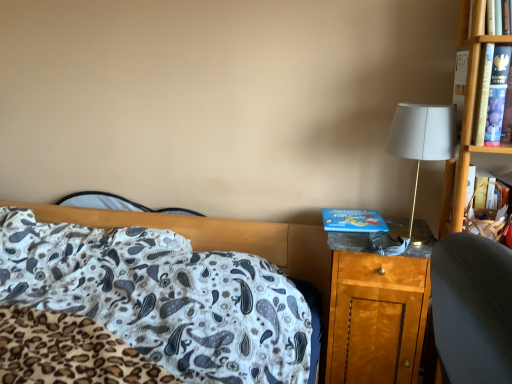
From the picture: Measure the distance between point (66, 311) and camera.

Point (66, 311) is 5.00 feet away from camera.

Describe the element at coordinates (421, 144) in the screenshot. This screenshot has height=384, width=512. I see `white fabric lampshade at right` at that location.

The image size is (512, 384). Identify the location of white paisley fabric at center. (163, 297).

Which point is more distant from viewer, (x=179, y=300) or (x=404, y=116)?

The point (x=179, y=300) is more distant.

Is white paisley fabric at center with white fabric lampshade at right?

No, white paisley fabric at center is not with white fabric lampshade at right.

Is white paisley fabric at center positioned beyond the bounds of white fabric lampshade at right?

Yes, white paisley fabric at center is located beyond the bounds of white fabric lampshade at right.

Based on the photo, looking at the image, does white paisley fabric at center seem bigger or smaller compared to white fabric lampshade at right?

Clearly, white paisley fabric at center is larger in size than white fabric lampshade at right.

Is wooden nightstand at right smaller than white paisley fabric at center?

Correct, wooden nightstand at right occupies less space than white paisley fabric at center.

Considering the points (361, 381) and (226, 257), which point is behind, point (361, 381) or point (226, 257)?

Positioned behind is point (226, 257).

Based on the photo, is the position of wooden nightstand at right more distant than that of white paisley fabric at center?

Yes, it is behind white paisley fabric at center.

Between wooden nightstand at right and white paisley fabric at center, which one has larger width?

Wider between the two is white paisley fabric at center.

Considering the sizes of objects white paisley fabric at center and wooden nightstand at right in the image provided, who is wider, white paisley fabric at center or wooden nightstand at right?

white paisley fabric at center.

Which is behind, point (210, 317) or point (428, 297)?

The point (428, 297) is behind.

Does white paisley fabric at center touch wooden nightstand at right?

white paisley fabric at center is not next to wooden nightstand at right, and they're not touching.

From the image's perspective, who appears lower, white fabric lampshade at right or wooden nightstand at right?

wooden nightstand at right.

Does white fabric lampshade at right contain wooden nightstand at right?

No, wooden nightstand at right is located outside of white fabric lampshade at right.

Which is farther from the camera, (435, 160) or (395, 368)?

The point (395, 368) is more distant.

In terms of width, does blue cardboard book at right look wider or thinner when compared to white paisley fabric at center?

blue cardboard book at right is thinner than white paisley fabric at center.

Locate an element on the screen. Image resolution: width=512 pixels, height=384 pixels. bed below the blue cardboard book at right (from the image's perspective) is located at coordinates click(x=163, y=297).

Considering the relative positions of blue cardboard book at right and white paisley fabric at center in the image provided, is blue cardboard book at right to the left of white paisley fabric at center from the viewer's perspective?

Incorrect, blue cardboard book at right is not on the left side of white paisley fabric at center.

Does wooden nightstand at right appear on the right side of white fabric lampshade at right?

In fact, wooden nightstand at right is to the left of white fabric lampshade at right.

From a real-world perspective, is wooden nightstand at right above or below white fabric lampshade at right?

From a real-world perspective, wooden nightstand at right is physically below white fabric lampshade at right.

Looking at this image, from the image's perspective, is wooden nightstand at right over white fabric lampshade at right?

No, from the image's perspective, wooden nightstand at right is not on top of white fabric lampshade at right.

Considering the sizes of objects wooden nightstand at right and white fabric lampshade at right in the image provided, who is taller, wooden nightstand at right or white fabric lampshade at right?

Standing taller between the two is wooden nightstand at right.

Is wooden nightstand at right wider than blue cardboard book at right?

Correct, the width of wooden nightstand at right exceeds that of blue cardboard book at right.

Measure the distance between wooden nightstand at right and blue cardboard book at right.

11.95 inches.

From a real-world perspective, who is located lower, wooden nightstand at right or blue cardboard book at right?

wooden nightstand at right.

Where is `bed below the white fabric lampshade at right (from the image's perspective)`? This screenshot has width=512, height=384. bed below the white fabric lampshade at right (from the image's perspective) is located at coordinates (163, 297).

Locate an element on the screen. Image resolution: width=512 pixels, height=384 pixels. bed lying above the wooden nightstand at right (from the image's perspective) is located at coordinates (163, 297).

From the picture: Estimate the real-world distances between objects in this image. Which object is closer to wooden nightstand at right, blue cardboard book at right or white paisley fabric at center?

Based on the image, blue cardboard book at right appears to be nearer to wooden nightstand at right.

Based on their spatial positions, is white paisley fabric at center or white fabric lampshade at right closer to wooden nightstand at right?

Among the two, white paisley fabric at center is located nearer to wooden nightstand at right.

Looking at the image, which one is located further to blue cardboard book at right, wooden nightstand at right or white paisley fabric at center?

Among the two, white paisley fabric at center is located further to blue cardboard book at right.

Estimate the real-world distances between objects in this image. Which object is closer to white paisley fabric at center, blue cardboard book at right or wooden nightstand at right?

Among the two, wooden nightstand at right is located nearer to white paisley fabric at center.

When comparing their distances from blue cardboard book at right, does white fabric lampshade at right or wooden nightstand at right seem further?

Based on the image, white fabric lampshade at right appears to be further to blue cardboard book at right.

Looking at the image, which one is located closer to white fabric lampshade at right, blue cardboard book at right or white paisley fabric at center?

blue cardboard book at right is positioned closer to the anchor white fabric lampshade at right.

Estimate the real-world distances between objects in this image. Which object is further from white fabric lampshade at right, white paisley fabric at center or wooden nightstand at right?

Among the two, white paisley fabric at center is located further to white fabric lampshade at right.

Looking at this image, when comparing their distances from white fabric lampshade at right, does wooden nightstand at right or white paisley fabric at center seem further?

white paisley fabric at center is positioned further to the anchor white fabric lampshade at right.

Find the location of `hardback book between white paisley fabric at center and white fabric lampshade at right`. hardback book between white paisley fabric at center and white fabric lampshade at right is located at coordinates (353, 220).

You are a GUI agent. You are given a task and a screenshot of the screen. Output one action in this format:
    pyautogui.click(x=<x>, y=<y>)
    Task: Click on the hardback book between white paisley fabric at center and wooden nightstand at right in the horizontal direction
    The image size is (512, 384).
    Given the screenshot: What is the action you would take?
    pyautogui.click(x=353, y=220)

Locate an element on the screen. Image resolution: width=512 pixels, height=384 pixels. hardback book between white fabric lampshade at right and wooden nightstand at right from top to bottom is located at coordinates (353, 220).

You are a GUI agent. You are given a task and a screenshot of the screen. Output one action in this format:
    pyautogui.click(x=<x>, y=<y>)
    Task: Click on the nightstand between white paisley fabric at center and white fabric lampshade at right from left to right
    
    Given the screenshot: What is the action you would take?
    pyautogui.click(x=377, y=311)